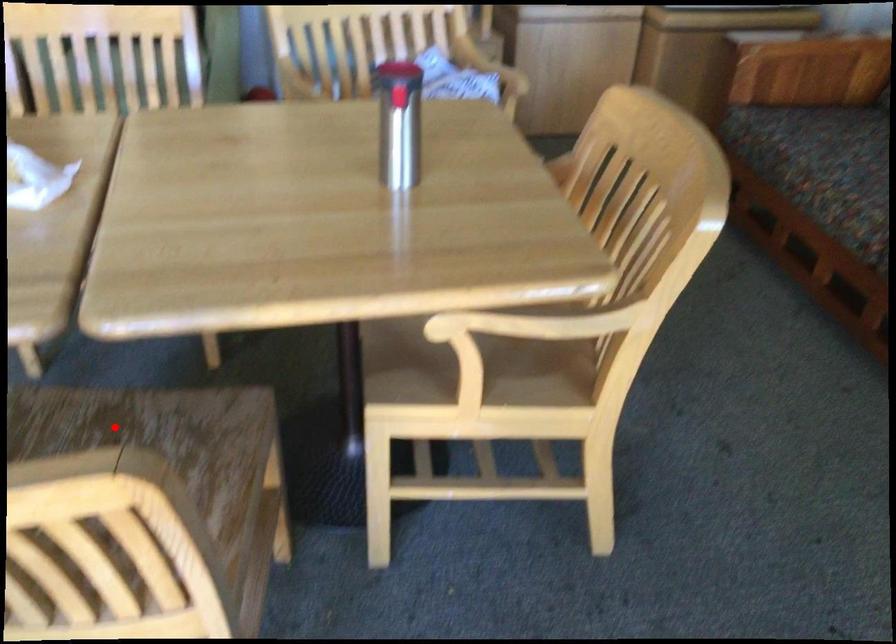
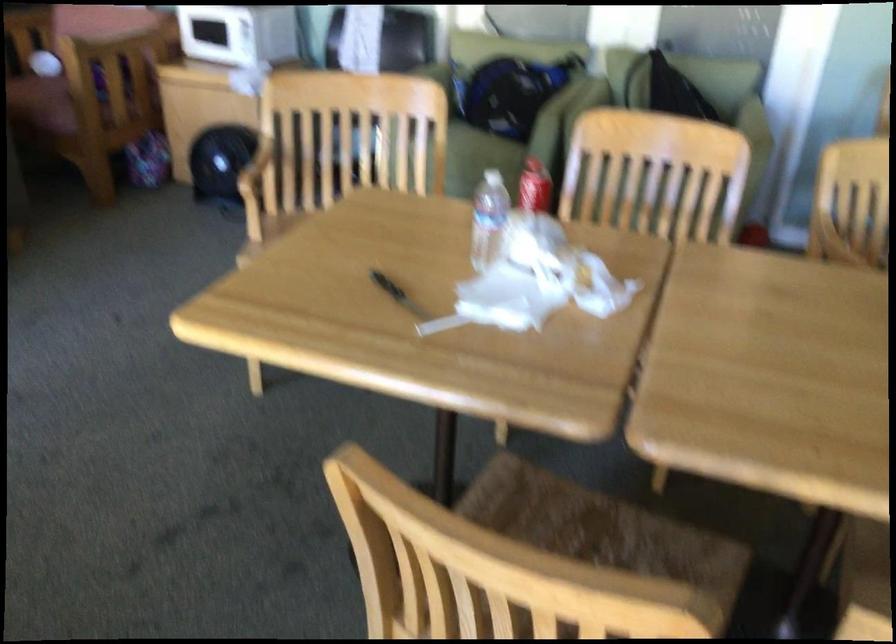
Find the pixel in the second image that matches the highlighted location in the first image.

(597, 527)